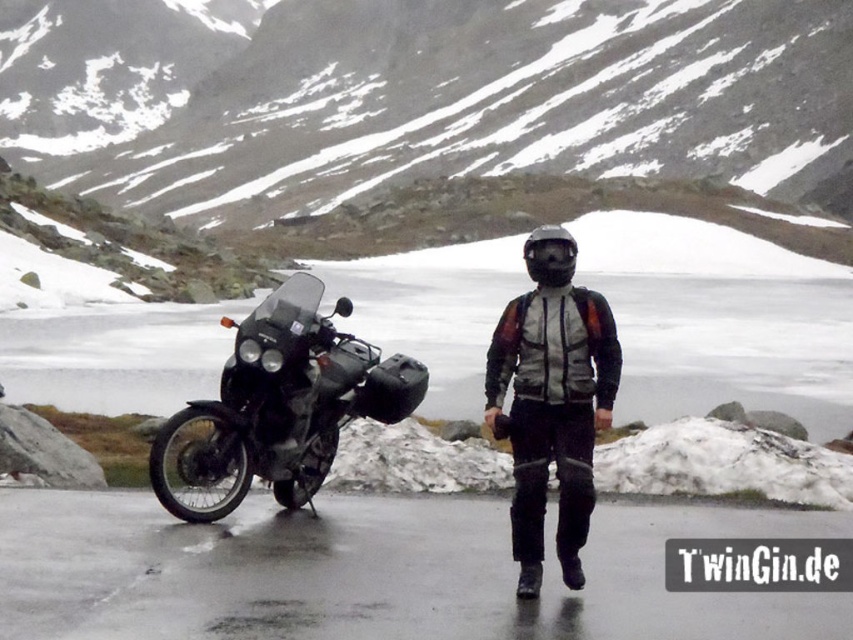
Question: Is snowy rock at center wider than matte black jacket at center?

Choices:
 (A) yes
 (B) no

Answer: (A)

Question: In this image, where is snowy rock at center located relative to matte black jacket at center?

Choices:
 (A) below
 (B) above

Answer: (B)

Question: Does snowy rock at center have a smaller size compared to matte black jacket at center?

Choices:
 (A) no
 (B) yes

Answer: (A)

Question: Which object is positioned closest to the matte black motorcycle at left?

Choices:
 (A) matte black jacket at center
 (B) snowy rock at center

Answer: (A)

Question: Which point appears farthest from the camera in this image?

Choices:
 (A) (115, 108)
 (B) (282, 440)
 (C) (570, 420)

Answer: (A)

Question: Which object is closer to the camera taking this photo?

Choices:
 (A) matte black motorcycle at left
 (B) matte black jacket at center
 (C) snowy rock at center

Answer: (B)